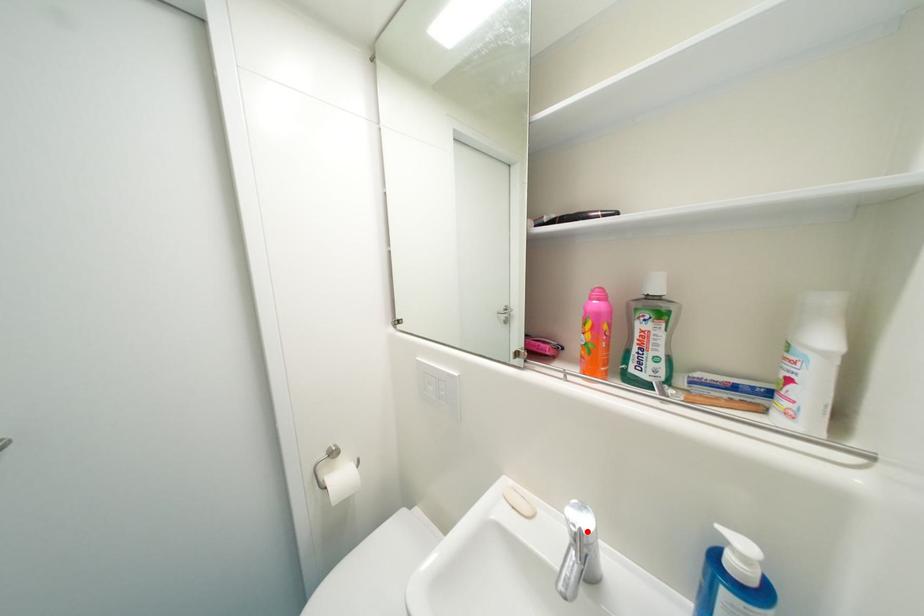
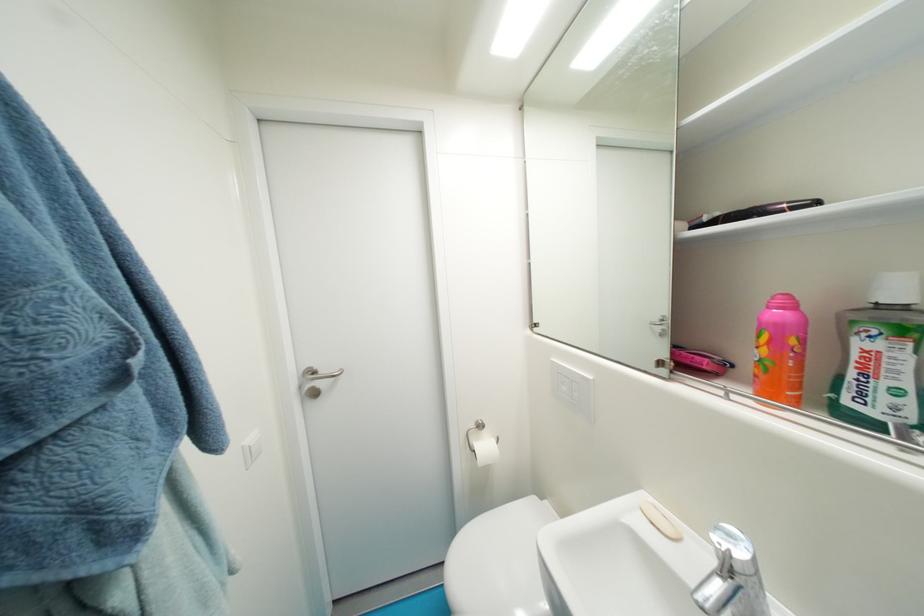
Find the pixel in the second image that matches the highlighted location in the first image.

(736, 553)